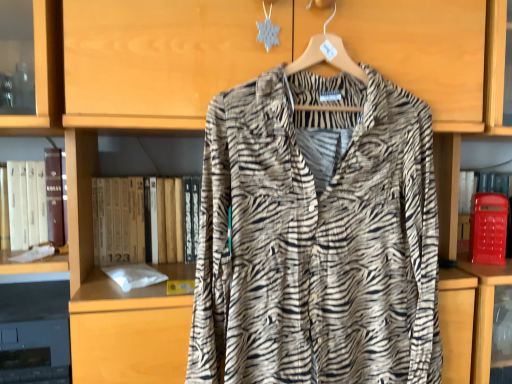
Question: In terms of width, does hardcover book at center, the second book when ordered from left to right, look wider or thinner when compared to zebra-patterned fabric shirt at center?

Choices:
 (A) thin
 (B) wide

Answer: (B)

Question: Is hardcover book at center, positioned as the first book in right-to-left order, in front of or behind zebra-patterned fabric shirt at center in the image?

Choices:
 (A) front
 (B) behind

Answer: (B)

Question: Which object is positioned farthest from the white paper at left, placed as the 1th book when sorted from left to right?

Choices:
 (A) hardcover book at center, positioned as the first book in right-to-left order
 (B) matte red phone box at right
 (C) zebra-patterned fabric shirt at center

Answer: (B)

Question: Estimate the real-world distances between objects in this image. Which object is closer to the matte red phone box at right?

Choices:
 (A) zebra-patterned fabric shirt at center
 (B) hardcover book at center, the second book when ordered from left to right
 (C) white paper at left, the 2th book viewed from the right

Answer: (A)